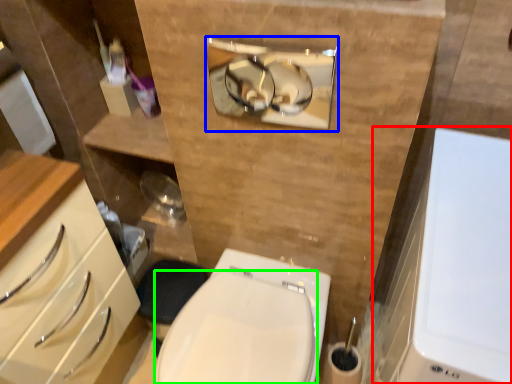
Question: Considering the real-world distances, which object is closest to medicine cabinet (highlighted by a red box)? medicine cabinet (highlighted by a blue box) or bidet (highlighted by a green box).

Choices:
 (A) medicine cabinet
 (B) bidet

Answer: (B)